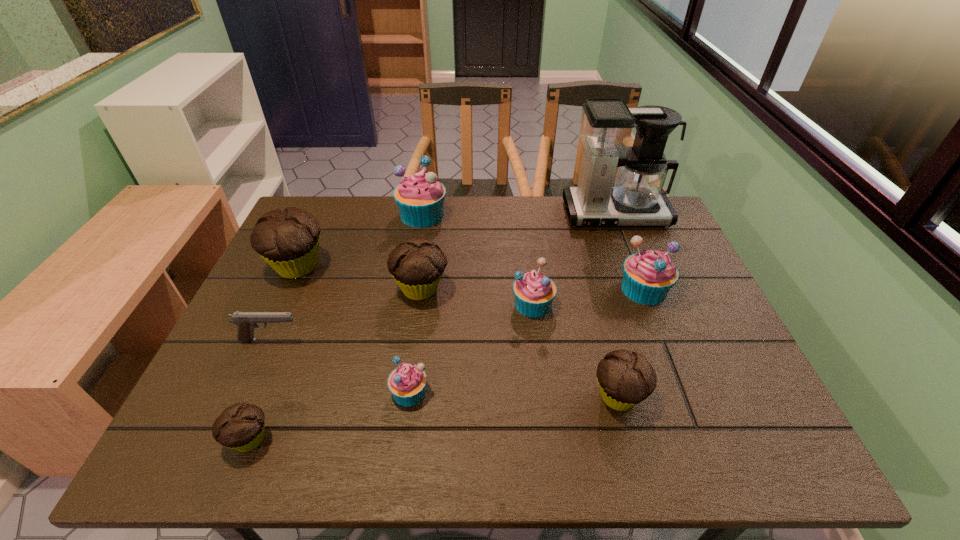
Identify which blue muffin is the third nearest to the farthest blue muffin. Please provide its 2D coordinates. Your answer should be formatted as a tuple, i.e. [(x, y)], where the tuple contains the x and y coordinates of a point satisfying the conditions above.

[(407, 383)]

Select which blue muffin is the third closest to the second blue muffin from right to left. Please provide its 2D coordinates. Your answer should be formatted as a tuple, i.e. [(x, y)], where the tuple contains the x and y coordinates of a point satisfying the conditions above.

[(420, 197)]

I want to click on chocolate muffin identified as the third closest to the farthest muffin, so [x=625, y=379].

What are the coordinates of `chocolate muffin that is the second closest one to the fourth nearest object` in the screenshot? It's located at (240, 427).

The height and width of the screenshot is (540, 960). I want to click on vacant region that satisfies the following two spatial constraints: 1. on the front side of the third smallest chocolate muffin; 2. on the left side of the farthest blue muffin, so click(410, 289).

Locate an element on the screen. vacant point that satisfies the following two spatial constraints: 1. on the back side of the smallest blue muffin; 2. on the right side of the sixth muffin from left to right is located at coordinates (421, 304).

Identify the location of free space that satisfies the following two spatial constraints: 1. at the front of the gray coffee maker where the controls are located; 2. at the barrel of the pistol. The image size is (960, 540). (663, 340).